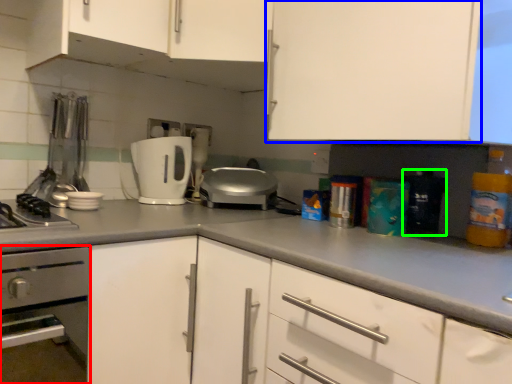
Question: Estimate the real-world distances between objects in this image. Which object is farther from home appliance (highlighted by a red box), cabinetry (highlighted by a blue box) or appliance (highlighted by a green box)?

Choices:
 (A) cabinetry
 (B) appliance

Answer: (B)